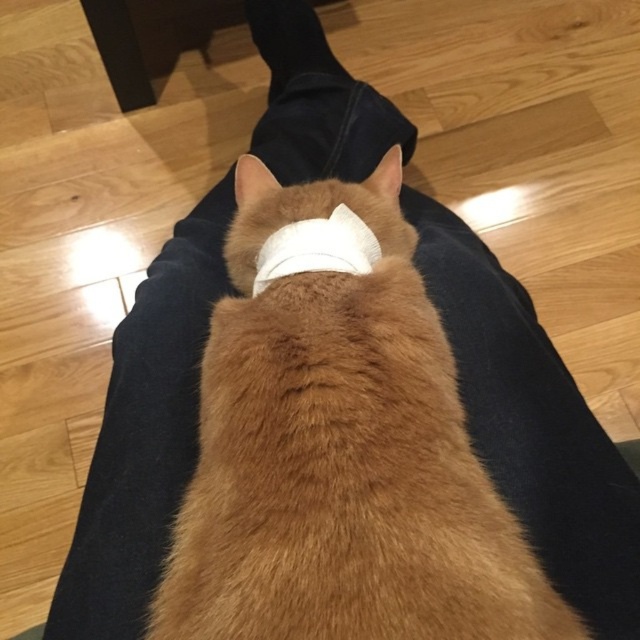
Question: Can you confirm if orange fur cat at center is thinner than white fabric bandage at center?

Choices:
 (A) yes
 (B) no

Answer: (B)

Question: Which of the following is the closest to the observer?

Choices:
 (A) white fabric bandage at center
 (B) orange fur cat at center

Answer: (B)

Question: Among these objects, which one is farthest from the camera?

Choices:
 (A) white fabric bandage at center
 (B) orange fur cat at center

Answer: (A)

Question: Is orange fur cat at center smaller than white fabric bandage at center?

Choices:
 (A) yes
 (B) no

Answer: (B)

Question: Does orange fur cat at center appear under white fabric bandage at center?

Choices:
 (A) yes
 (B) no

Answer: (A)